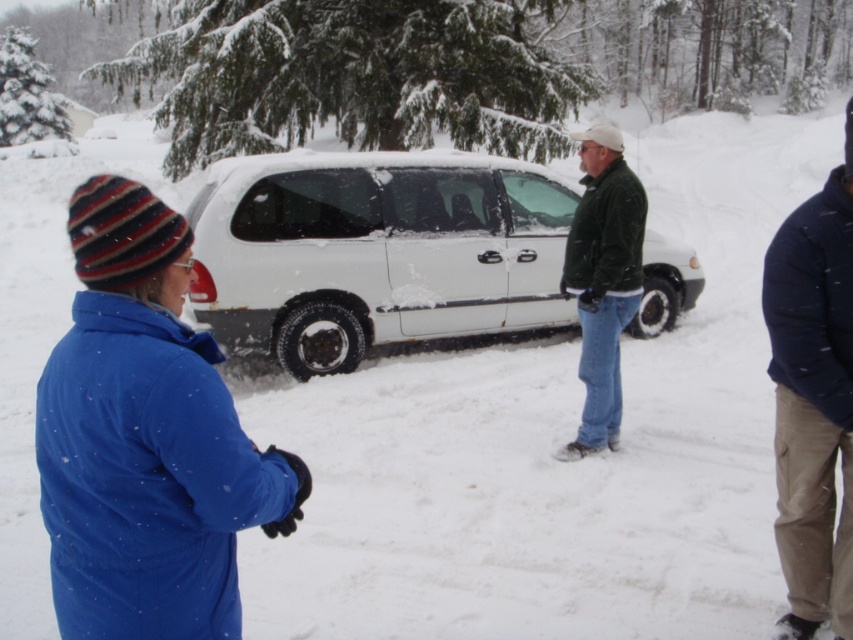
Is white matte van at center to the left of green fuzzy jacket at center from the viewer's perspective?

Indeed, white matte van at center is positioned on the left side of green fuzzy jacket at center.

Is white matte van at center to the right of green fuzzy jacket at center from the viewer's perspective?

In fact, white matte van at center is to the left of green fuzzy jacket at center.

Is point (379, 298) farther from viewer compared to point (592, 291)?

That is True.

This screenshot has width=853, height=640. In order to click on white matte van at center in this screenshot , I will do 375,252.

Measure the distance between white matte van at center and dark blue fleece jacket at right.

The distance of white matte van at center from dark blue fleece jacket at right is 3.95 meters.

Does white matte van at center have a lesser height compared to dark blue fleece jacket at right?

No, white matte van at center is not shorter than dark blue fleece jacket at right.

The image size is (853, 640). I want to click on white matte van at center, so click(x=375, y=252).

Does dark blue fleece jacket at right have a greater width compared to green fuzzy jacket at center?

Indeed, dark blue fleece jacket at right has a greater width compared to green fuzzy jacket at center.

Consider the image. How much distance is there between dark blue fleece jacket at right and green fuzzy jacket at center?

A: dark blue fleece jacket at right and green fuzzy jacket at center are 2.24 meters apart from each other.

Locate an element on the screen. dark blue fleece jacket at right is located at coordinates (813, 400).